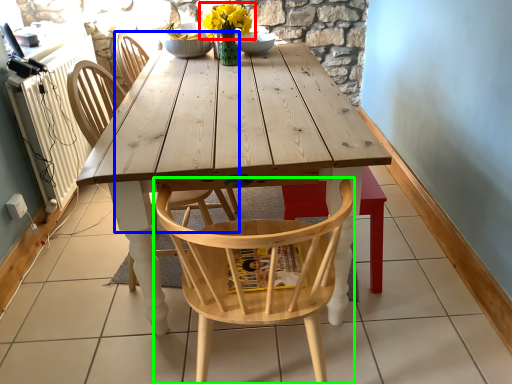
Question: Estimate the real-world distances between objects in this image. Which object is closer to flower (highlighted by a red box), chair (highlighted by a blue box) or chair (highlighted by a green box)?

Choices:
 (A) chair
 (B) chair

Answer: (A)